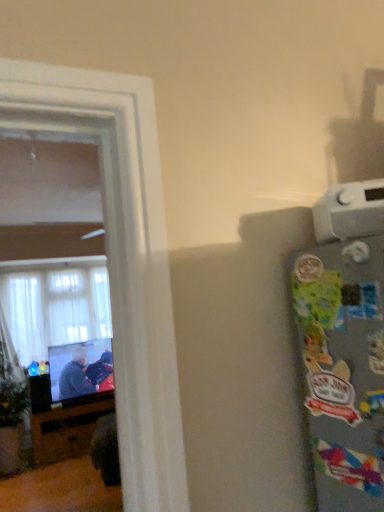
Question: From a real-world perspective, is white sheer curtains at left physically above black glossy entertainment center at left?

Choices:
 (A) yes
 (B) no

Answer: (A)

Question: Does white sheer curtains at left have a lesser height compared to black glossy entertainment center at left?

Choices:
 (A) no
 (B) yes

Answer: (A)

Question: From the image's perspective, is white sheer curtains at left beneath black glossy entertainment center at left?

Choices:
 (A) yes
 (B) no

Answer: (B)

Question: Is white sheer curtains at left turned away from black glossy entertainment center at left?

Choices:
 (A) yes
 (B) no

Answer: (B)

Question: Is white sheer curtains at left to the left of black glossy entertainment center at left from the viewer's perspective?

Choices:
 (A) no
 (B) yes

Answer: (B)

Question: From the image's perspective, is green matte plant at left positioned above or below dark gray sweater at left?

Choices:
 (A) above
 (B) below

Answer: (B)

Question: Is green matte plant at left in front of or behind dark gray sweater at left in the image?

Choices:
 (A) behind
 (B) front

Answer: (B)

Question: In terms of width, does green matte plant at left look wider or thinner when compared to dark gray sweater at left?

Choices:
 (A) thin
 (B) wide

Answer: (B)

Question: Is green matte plant at left inside or outside of dark gray sweater at left?

Choices:
 (A) inside
 (B) outside

Answer: (B)

Question: Looking at their shapes, would you say dark gray sweater at left is wider or thinner than white sheer curtains at left?

Choices:
 (A) thin
 (B) wide

Answer: (A)

Question: Based on their sizes in the image, would you say dark gray sweater at left is bigger or smaller than white sheer curtains at left?

Choices:
 (A) small
 (B) big

Answer: (A)

Question: From the image's perspective, is dark gray sweater at left positioned above or below white sheer curtains at left?

Choices:
 (A) below
 (B) above

Answer: (A)

Question: In the image, is dark gray sweater at left positioned in front of or behind white sheer curtains at left?

Choices:
 (A) front
 (B) behind

Answer: (A)

Question: From their relative heights in the image, would you say white plastic thermostat at upper right is taller or shorter than white sheer curtains at left?

Choices:
 (A) short
 (B) tall

Answer: (A)

Question: From the image's perspective, is white plastic thermostat at upper right above or below white sheer curtains at left?

Choices:
 (A) below
 (B) above

Answer: (B)